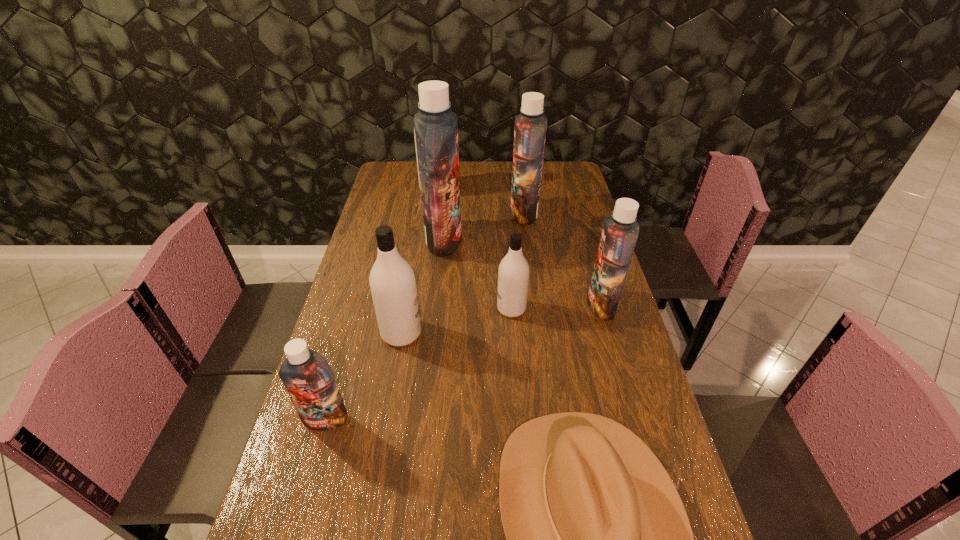
The width and height of the screenshot is (960, 540). I want to click on the nearest blue shampoo, so click(x=309, y=380).

Find the location of a particular element. This screenshot has height=540, width=960. vacant space situated 0.310m on the front label of the tallest object is located at coordinates (548, 239).

The image size is (960, 540). In order to click on blank space located on the front label of the third blue shampoo from left to right in this screenshot , I will do `click(471, 213)`.

Image resolution: width=960 pixels, height=540 pixels. Find the location of `free space located on the front label of the third blue shampoo from left to right`. free space located on the front label of the third blue shampoo from left to right is located at coordinates (474, 213).

What are the coordinates of `vacant space located on the front label of the third blue shampoo from left to right` in the screenshot? It's located at (471, 213).

The image size is (960, 540). What are the coordinates of `vacant space located 0.360m on the front-facing side of the farthest object` in the screenshot? It's located at (428, 254).

You are a GUI agent. You are given a task and a screenshot of the screen. Output one action in this format:
    pyautogui.click(x=<x>, y=<y>)
    Task: Click on the vacant space situated on the front label of the second smallest blue shampoo
    
    Given the screenshot: What is the action you would take?
    coord(456,304)

Where is `vacant point located 0.340m on the front label of the second smallest blue shampoo`? vacant point located 0.340m on the front label of the second smallest blue shampoo is located at coordinates (476, 304).

I want to click on blank area located 0.270m on the front label of the second smallest blue shampoo, so click(499, 304).

At what (x,y) coordinates should I click in order to perform the action: click on vacant position located 0.290m on the front-facing side of the second biggest white shampoo. Please return your answer as a coordinate pair (x, y). Looking at the image, I should click on (524, 333).